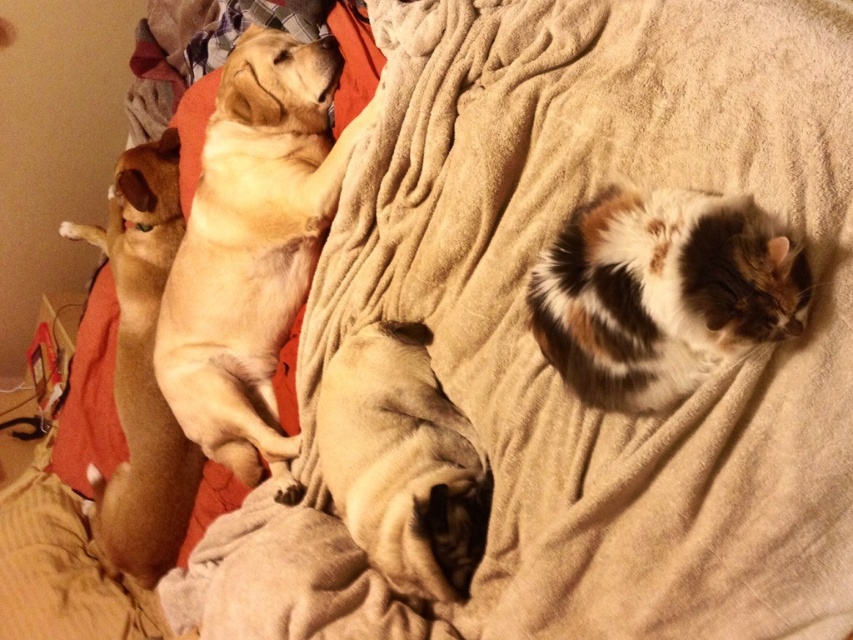
You are a pet photographer trying to fit both the golden fur dog at center and the brown furry dog at left into a single photo. Based on their positions and sizes, can you estimate if they will both fit within the camera frame?

The golden fur dog at center might be wider than brown furry dog at left, so there might not be enough space to fit both into the frame if the golden fur dog at center takes up more width.

You are a photographer trying to capture a clear shot of the brown soft pug at center. However, the calico fur cat at right is blocking your view. Can you determine if the cat is directly in front of the pug?

The calico fur cat at right is positioned over brown soft pug at center, so yes, the cat is directly in front of the pug, blocking the view.